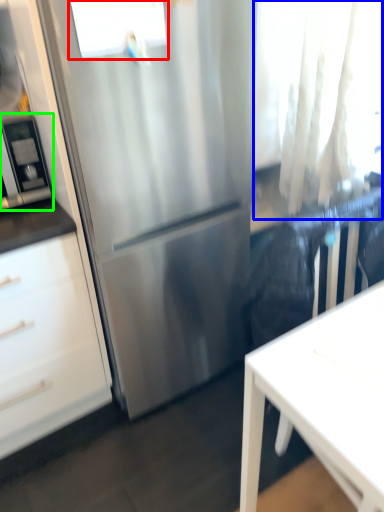
Question: Which object is positioned farthest from window (highlighted by a red box)? Select from curtain (highlighted by a blue box) and appliance (highlighted by a green box).

Choices:
 (A) curtain
 (B) appliance

Answer: (A)